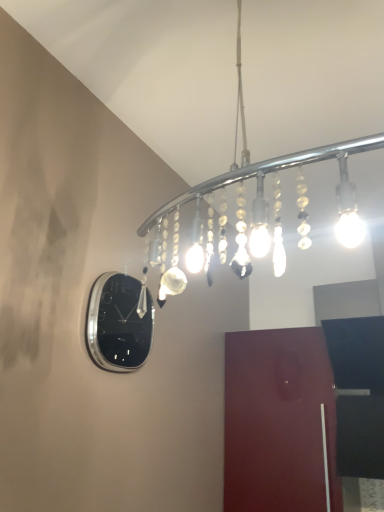
Question: Does glossy wood door at lower right appear on the right side of clear glass chandelier at upper center?

Choices:
 (A) yes
 (B) no

Answer: (A)

Question: From a real-world perspective, is glossy wood door at lower right beneath clear glass chandelier at upper center?

Choices:
 (A) yes
 (B) no

Answer: (A)

Question: Can you confirm if glossy wood door at lower right is wider than clear glass chandelier at upper center?

Choices:
 (A) yes
 (B) no

Answer: (B)

Question: Does glossy wood door at lower right have a smaller size compared to clear glass chandelier at upper center?

Choices:
 (A) no
 (B) yes

Answer: (B)

Question: Does glossy wood door at lower right appear on the left side of clear glass chandelier at upper center?

Choices:
 (A) no
 (B) yes

Answer: (A)

Question: Is polished silver clock at upper left taller or shorter than glossy wood door at lower right?

Choices:
 (A) short
 (B) tall

Answer: (A)

Question: Is point (102, 311) positioned closer to the camera than point (259, 389)?

Choices:
 (A) farther
 (B) closer

Answer: (B)

Question: Considering their positions, is polished silver clock at upper left located in front of or behind glossy wood door at lower right?

Choices:
 (A) behind
 (B) front

Answer: (B)

Question: Which is correct: polished silver clock at upper left is inside glossy wood door at lower right, or outside of it?

Choices:
 (A) inside
 (B) outside

Answer: (B)

Question: In the image, is clear glass chandelier at upper center on the left side or the right side of glossy wood door at lower right?

Choices:
 (A) left
 (B) right

Answer: (A)

Question: Relative to glossy wood door at lower right, is clear glass chandelier at upper center in front or behind?

Choices:
 (A) front
 (B) behind

Answer: (A)

Question: Is clear glass chandelier at upper center inside the boundaries of glossy wood door at lower right, or outside?

Choices:
 (A) outside
 (B) inside

Answer: (A)

Question: In terms of size, does clear glass chandelier at upper center appear bigger or smaller than glossy wood door at lower right?

Choices:
 (A) small
 (B) big

Answer: (B)

Question: Looking at the image, does glossy wood door at lower right seem bigger or smaller compared to polished silver clock at upper left?

Choices:
 (A) small
 (B) big

Answer: (B)

Question: Considering the positions of glossy wood door at lower right and polished silver clock at upper left in the image, is glossy wood door at lower right wider or thinner than polished silver clock at upper left?

Choices:
 (A) thin
 (B) wide

Answer: (B)